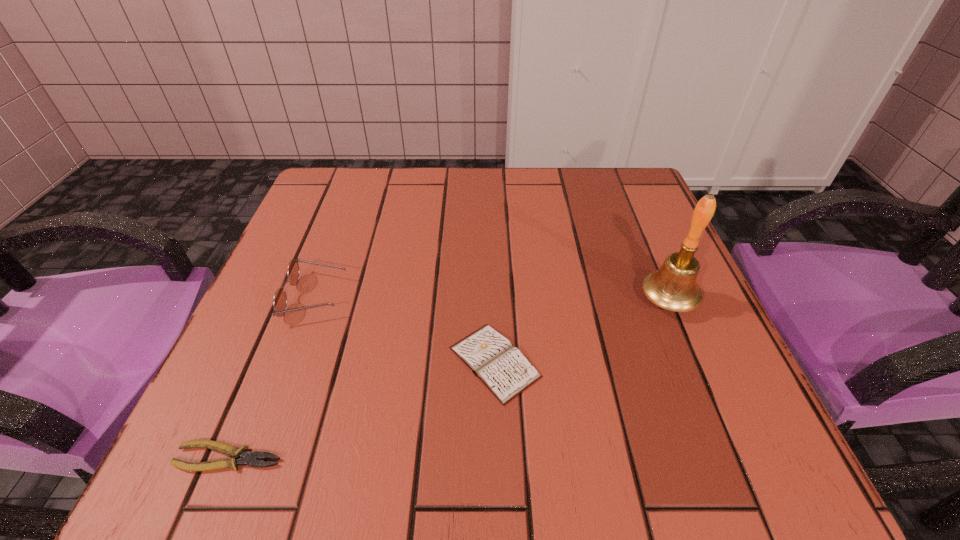
Find the location of `free spot located on the back of the shortest object`. free spot located on the back of the shortest object is located at coordinates (281, 330).

Locate an element on the screen. object situated at the near edge is located at coordinates (251, 459).

Where is `spectacles that is at the left edge`? This screenshot has height=540, width=960. spectacles that is at the left edge is located at coordinates (280, 299).

This screenshot has width=960, height=540. What are the coordinates of `pliers located at the left edge` in the screenshot? It's located at (251, 459).

Locate an element on the screen. The image size is (960, 540). object that is at the right edge is located at coordinates (673, 287).

Image resolution: width=960 pixels, height=540 pixels. What are the coordinates of `object present at the near left corner` in the screenshot? It's located at (251, 459).

Image resolution: width=960 pixels, height=540 pixels. What are the coordinates of `free space at the far edge of the desktop` in the screenshot? It's located at (450, 170).

The height and width of the screenshot is (540, 960). I want to click on vacant region at the near edge, so click(x=323, y=431).

The height and width of the screenshot is (540, 960). Find the location of `vacant position at the left edge of the desktop`. vacant position at the left edge of the desktop is located at coordinates (353, 247).

This screenshot has width=960, height=540. Find the location of `vacant region at the right edge of the desktop`. vacant region at the right edge of the desktop is located at coordinates (605, 247).